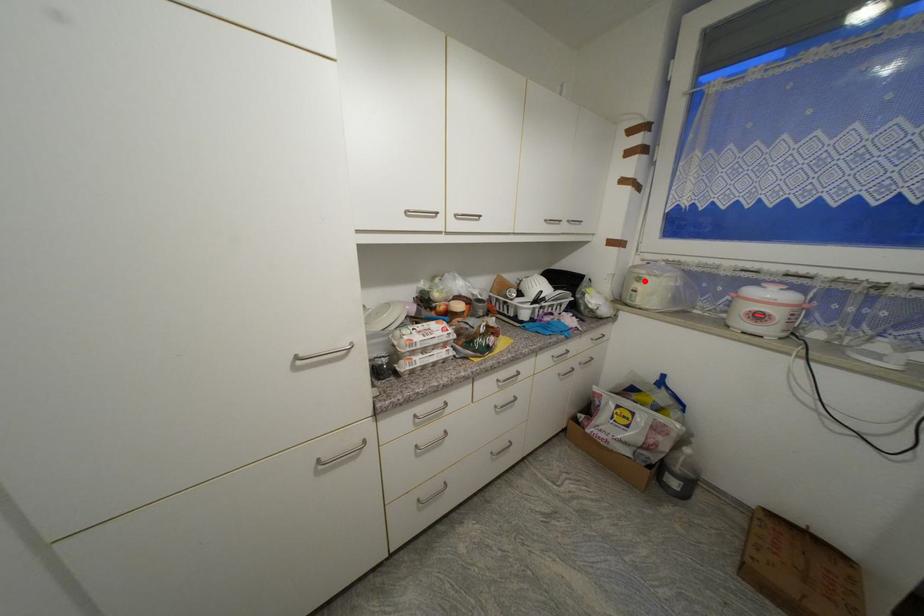
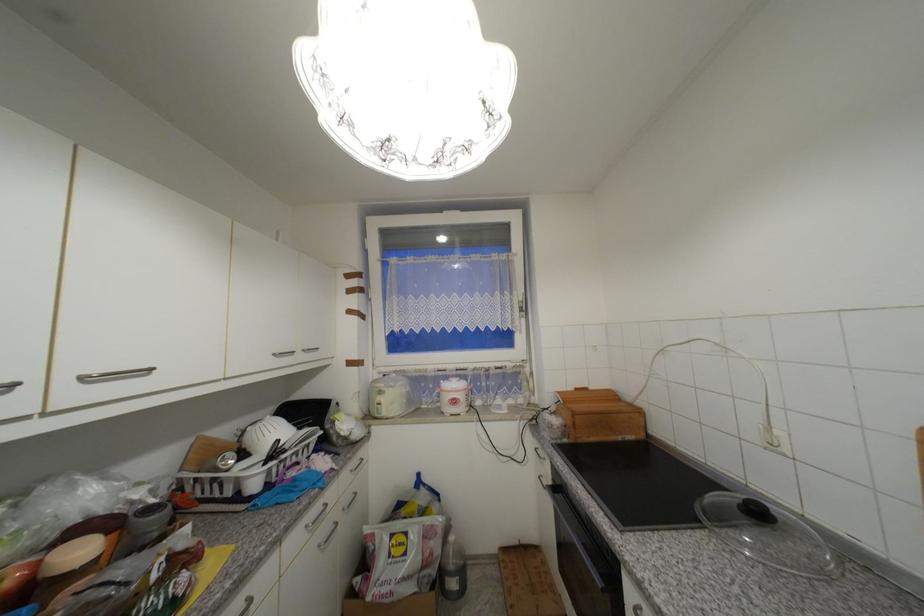
In the second image, find the point that corresponds to the highlighted location in the first image.

(386, 394)